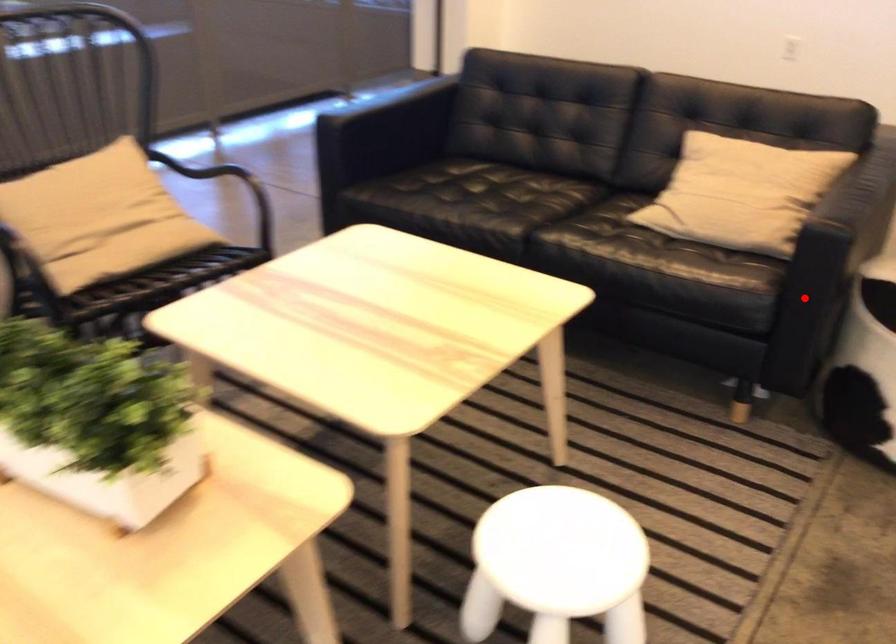
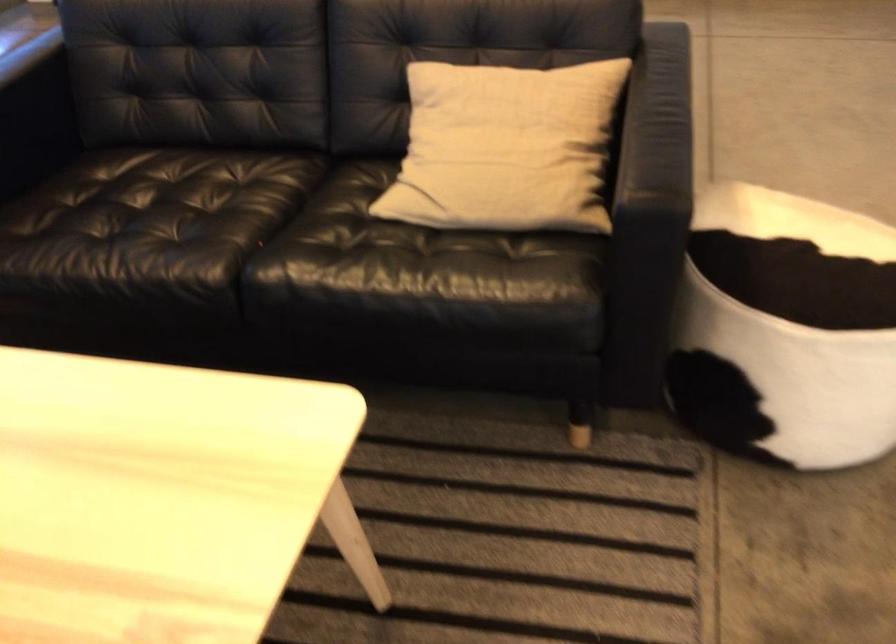
In the second image, find the point that corresponds to the highlighted location in the first image.

(644, 298)